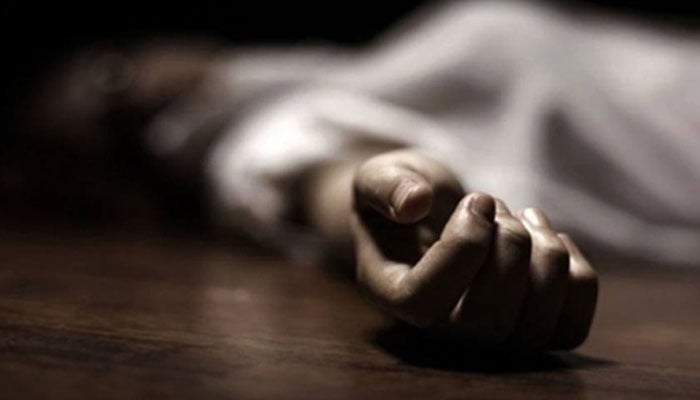
What are the coordinates of `floor` in the screenshot? It's located at (206, 304).